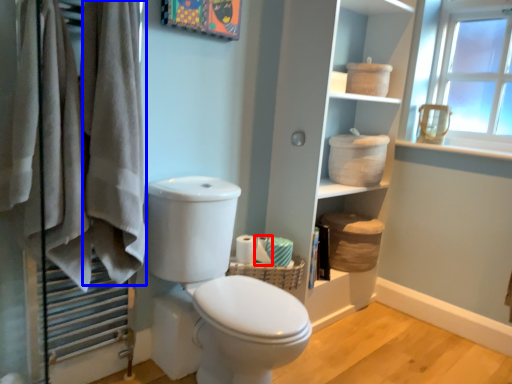
Question: Among these objects, which one is nearest to the camera, toilet paper (highlighted by a red box) or bath towel (highlighted by a blue box)?

Choices:
 (A) toilet paper
 (B) bath towel

Answer: (B)